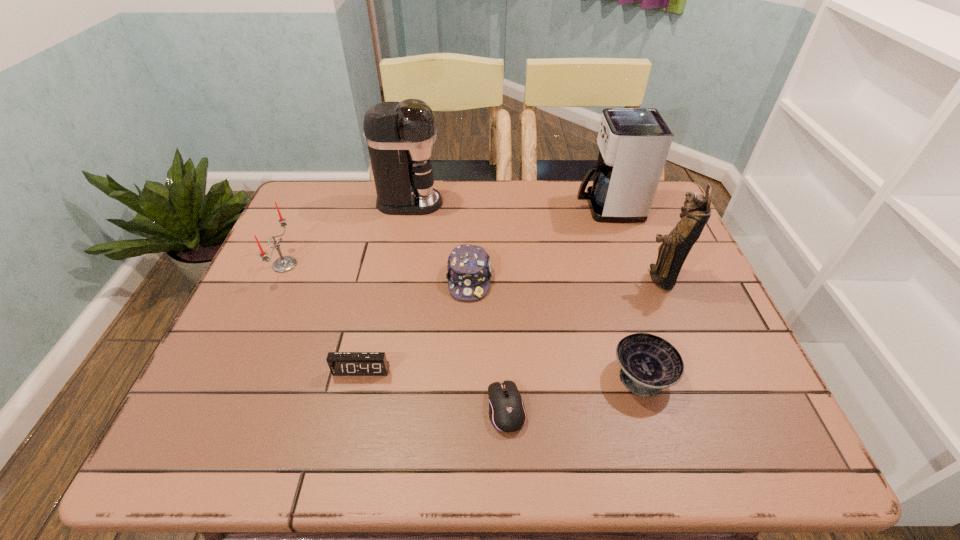
At what (x,y) coordinates should I click in order to perform the action: click on free space located 0.380m on the front panel of the right coffee maker. Please return your answer as a coordinate pair (x, y). The width and height of the screenshot is (960, 540). Looking at the image, I should click on (452, 207).

At what (x,y) coordinates should I click in order to perform the action: click on vacant space located on the front panel of the right coffee maker. Please return your answer as a coordinate pair (x, y). Looking at the image, I should click on (456, 207).

This screenshot has height=540, width=960. I want to click on free space located on the front panel of the right coffee maker, so click(449, 207).

In order to click on vacant space positioned on the front-facing side of the figurine in this screenshot , I will do `click(533, 278)`.

Locate an element on the screen. This screenshot has height=540, width=960. vacant space located on the front-facing side of the figurine is located at coordinates (541, 278).

Where is `vacant area situated on the front-facing side of the figurine`? vacant area situated on the front-facing side of the figurine is located at coordinates (561, 278).

This screenshot has width=960, height=540. Find the location of `vacant space located on the front-facing side of the fourth tallest object`. vacant space located on the front-facing side of the fourth tallest object is located at coordinates (372, 265).

The width and height of the screenshot is (960, 540). What are the coordinates of `vacant region located on the front-facing side of the headwear` in the screenshot? It's located at (467, 381).

The width and height of the screenshot is (960, 540). What are the coordinates of `vacant space situated on the right of the bowl` in the screenshot? It's located at (745, 375).

Image resolution: width=960 pixels, height=540 pixels. In order to click on free space located on the front-facing side of the alarm clock in this screenshot , I will do (350, 420).